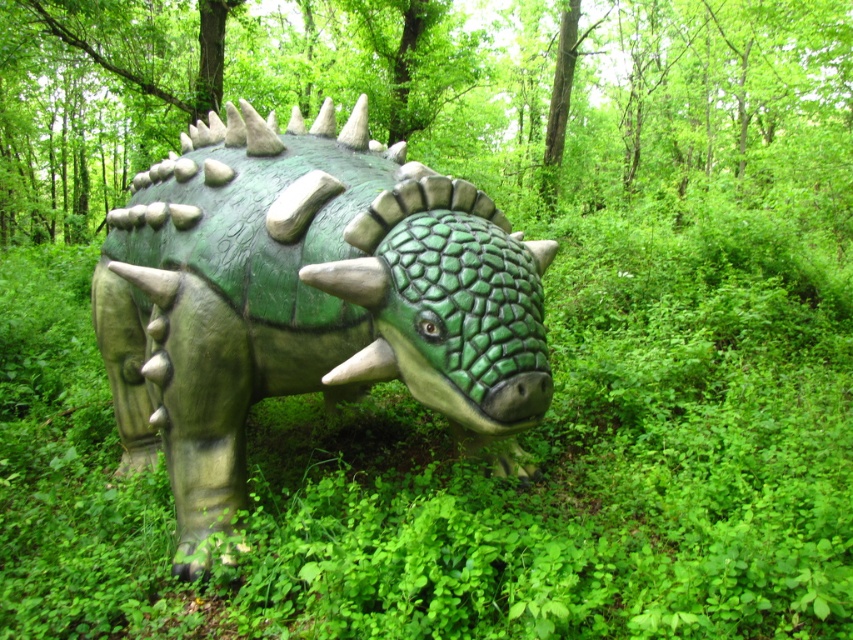
Question: Which point is farther from the camera taking this photo?

Choices:
 (A) (508, 499)
 (B) (334, 328)

Answer: (A)

Question: Does green matte grass at center have a smaller size compared to green matte textured dinosaur at center?

Choices:
 (A) no
 (B) yes

Answer: (B)

Question: Does green matte grass at center have a lesser width compared to green matte textured dinosaur at center?

Choices:
 (A) no
 (B) yes

Answer: (B)

Question: Which point appears farthest from the camera in this image?

Choices:
 (A) (578, 547)
 (B) (212, 353)

Answer: (B)

Question: Is green matte grass at center further to the viewer compared to green matte textured dinosaur at center?

Choices:
 (A) yes
 (B) no

Answer: (A)